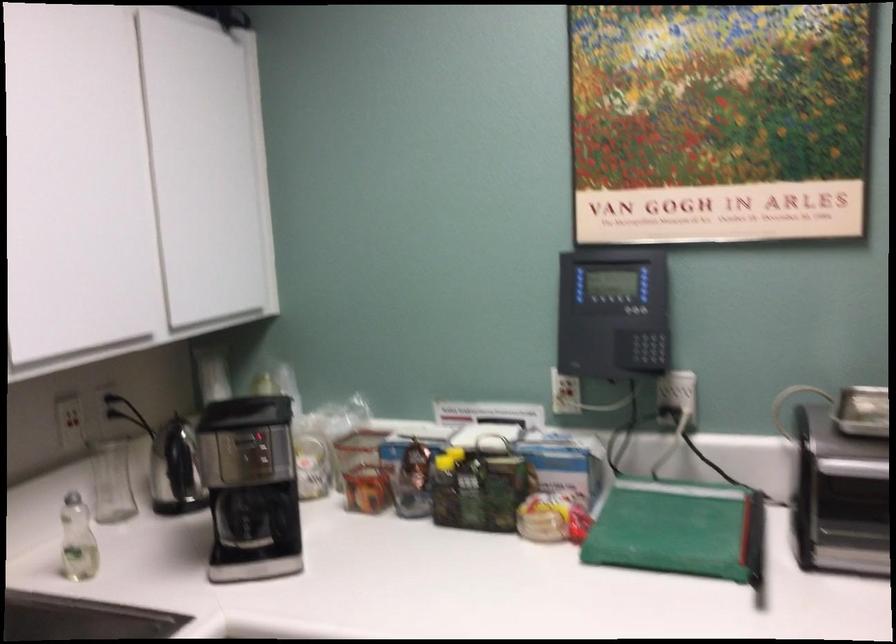
Describe the element at coordinates (444, 462) in the screenshot. The height and width of the screenshot is (644, 896). I see `the yellow bottle cap` at that location.